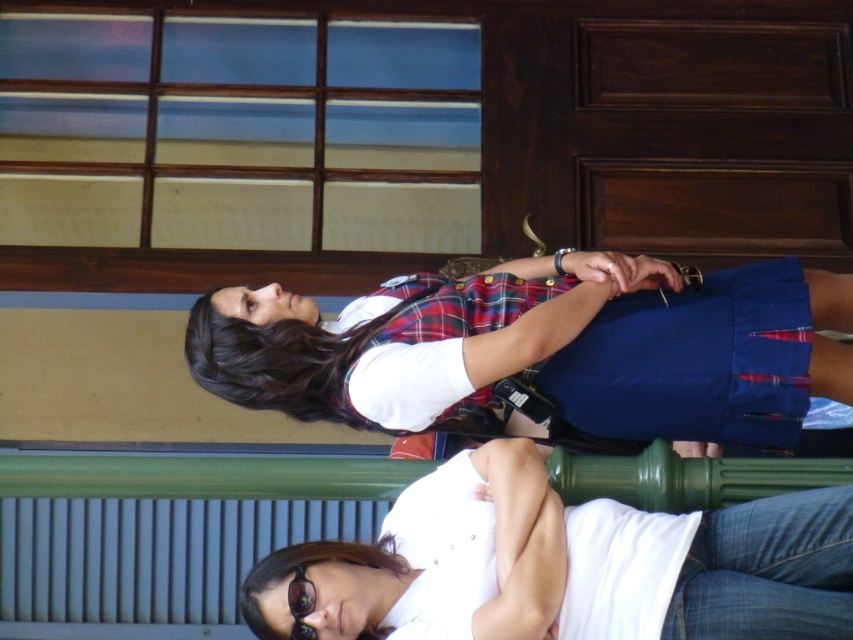
You are a photographer trying to capture a portrait of the white cotton shirt at center. Where should you position your camera to ensure the shirt is in the center of the frame?

To center the white cotton shirt at center in the frame, position the camera so that the shirt aligns with the center point at coordinates approximately 0.873 on the x axis and 0.665 on the y axis.

You are trying to locate the matte plaid vest at center and the white cotton shirt at center in the image. Which one is positioned to the left?

The matte plaid vest at center is to the left of the white cotton shirt at center.

You are a security guard in a museum and need to check the items displayed in the image. Are the translucent plastic goggles at lower center located below the white cotton shirt at center?

Yes, the translucent plastic goggles at lower center are located below the white cotton shirt at center as the white cotton shirt at center is above the goggles.